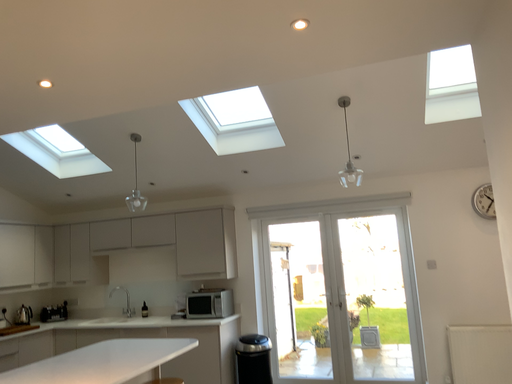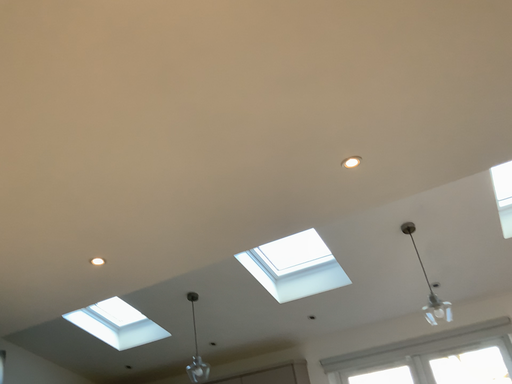
Question: Which way did the camera rotate in the video?

Choices:
 (A) rotated right
 (B) rotated left

Answer: (B)